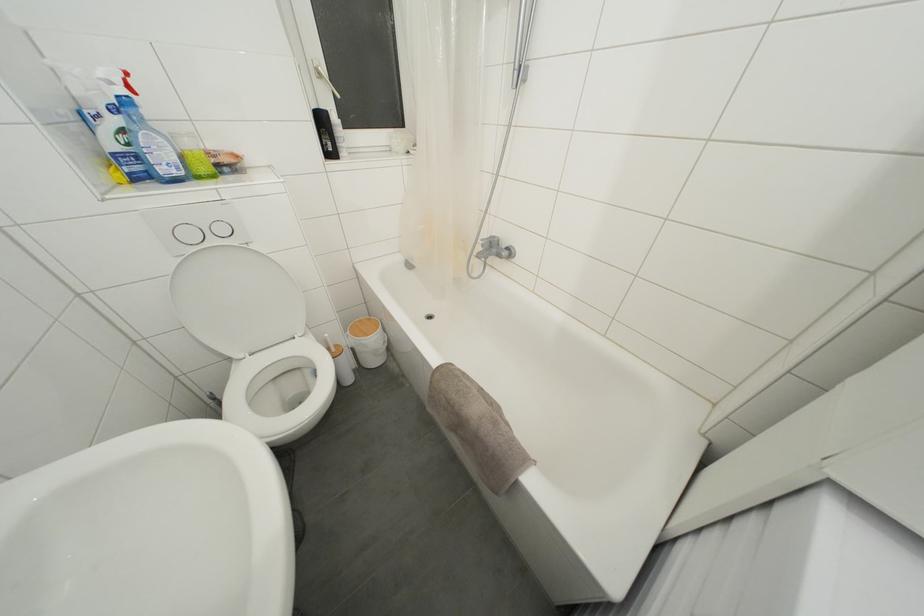
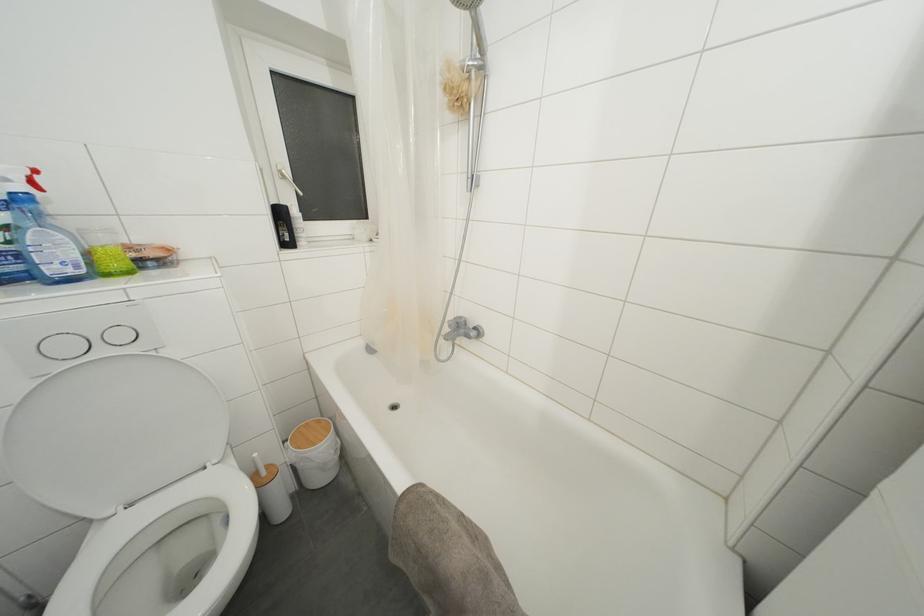
Where in the second image is the point corresponding to the point at 441,373 from the first image?

(407, 498)